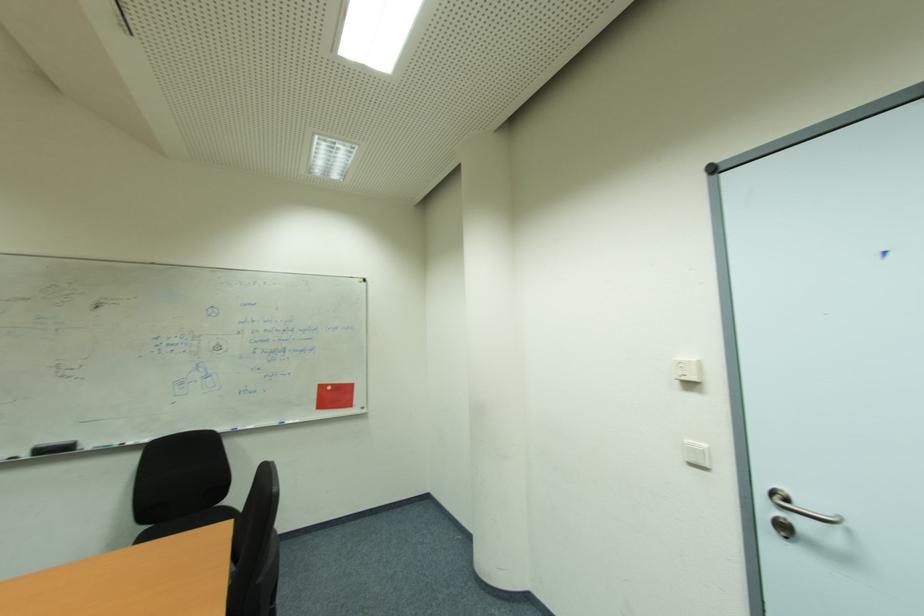
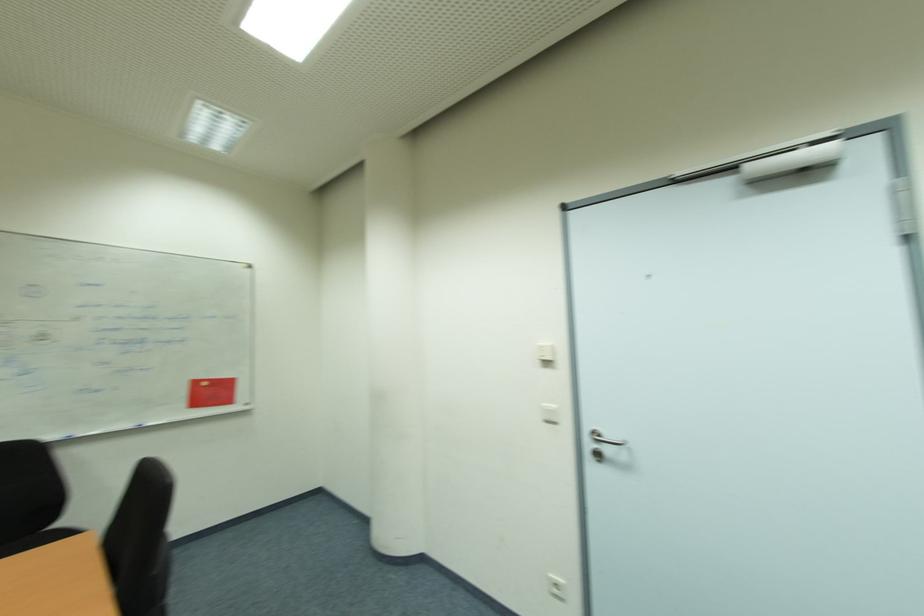
In the second image, find the point that corresponds to point 707,446 in the first image.

(556, 407)